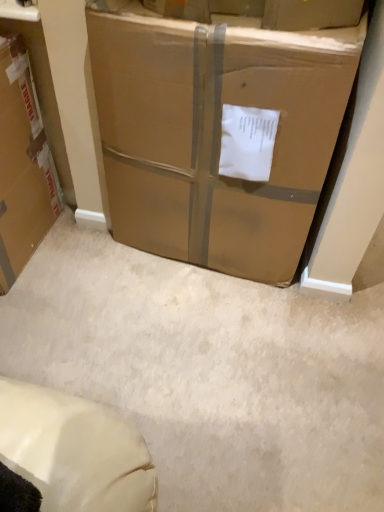
Find the location of a particular element. This screenshot has width=384, height=512. brown cardboard box at center, the 2th box in the left-to-right sequence is located at coordinates pos(215,134).

This screenshot has height=512, width=384. What do you see at coordinates (215, 134) in the screenshot?
I see `brown cardboard box at center, which is the 1th box in right-to-left order` at bounding box center [215, 134].

Identify the location of brown cardboard box at left, placed as the 2th box when sorted from right to left. The height and width of the screenshot is (512, 384). (22, 165).

What do you see at coordinates (22, 165) in the screenshot? I see `brown cardboard box at left, placed as the 2th box when sorted from right to left` at bounding box center [22, 165].

Identify the location of brown cardboard box at center, the 2th box in the left-to-right sequence. The height and width of the screenshot is (512, 384). (215, 134).

Can you confirm if brown cardboard box at left, placed as the first box when sorted from left to right, is positioned to the right of brown cardboard box at center, which is the 1th box in right-to-left order?

Incorrect, brown cardboard box at left, placed as the first box when sorted from left to right, is not on the right side of brown cardboard box at center, which is the 1th box in right-to-left order.

Which object is further away from the camera taking this photo, brown cardboard box at left, placed as the 2th box when sorted from right to left, or brown cardboard box at center, the 2th box in the left-to-right sequence?

brown cardboard box at left, placed as the 2th box when sorted from right to left, is further from the camera.

Considering the positions of point (2, 146) and point (187, 106), is point (2, 146) closer or farther from the camera than point (187, 106)?

Clearly, point (2, 146) is more distant from the camera than point (187, 106).

From the image's perspective, relative to brown cardboard box at center, the 2th box in the left-to-right sequence, is brown cardboard box at left, placed as the 2th box when sorted from right to left, above or below?

From the image's perspective, brown cardboard box at left, placed as the 2th box when sorted from right to left, appears below brown cardboard box at center, the 2th box in the left-to-right sequence.

From a real-world perspective, who is located lower, brown cardboard box at left, placed as the 2th box when sorted from right to left, or brown cardboard box at center, which is the 1th box in right-to-left order?

In real-world perspective, brown cardboard box at left, placed as the 2th box when sorted from right to left, is lower.

Does brown cardboard box at left, placed as the first box when sorted from left to right, have a lesser width compared to brown cardboard box at center, the 2th box in the left-to-right sequence?

In fact, brown cardboard box at left, placed as the first box when sorted from left to right, might be wider than brown cardboard box at center, the 2th box in the left-to-right sequence.

From their relative heights in the image, would you say brown cardboard box at left, placed as the 2th box when sorted from right to left, is taller or shorter than brown cardboard box at center, the 2th box in the left-to-right sequence?

In the image, brown cardboard box at left, placed as the 2th box when sorted from right to left, appears to be shorter than brown cardboard box at center, the 2th box in the left-to-right sequence.

Which of these two, brown cardboard box at left, placed as the first box when sorted from left to right, or brown cardboard box at center, the 2th box in the left-to-right sequence, is bigger?

brown cardboard box at center, the 2th box in the left-to-right sequence, is bigger.

Is brown cardboard box at left, placed as the first box when sorted from left to right, situated inside brown cardboard box at center, the 2th box in the left-to-right sequence, or outside?

brown cardboard box at left, placed as the first box when sorted from left to right, is outside brown cardboard box at center, the 2th box in the left-to-right sequence.

Is there a large distance between brown cardboard box at left, placed as the 2th box when sorted from right to left, and brown cardboard box at center, which is the 1th box in right-to-left order?

brown cardboard box at left, placed as the 2th box when sorted from right to left, is actually quite close to brown cardboard box at center, which is the 1th box in right-to-left order.

Is brown cardboard box at left, placed as the first box when sorted from left to right, positioned with its back to brown cardboard box at center, the 2th box in the left-to-right sequence?

No, brown cardboard box at center, the 2th box in the left-to-right sequence, is not at the back of brown cardboard box at left, placed as the first box when sorted from left to right.

What's the angular difference between brown cardboard box at left, placed as the first box when sorted from left to right, and brown cardboard box at center, the 2th box in the left-to-right sequence,'s facing directions?

They differ by 5.86 degrees in their facing directions.

Where is `box that is below the brown cardboard box at center, which is the 1th box in right-to-left order (from the image's perspective)`? box that is below the brown cardboard box at center, which is the 1th box in right-to-left order (from the image's perspective) is located at coordinates (22, 165).

In the scene shown: Considering the positions of objects brown cardboard box at center, the 2th box in the left-to-right sequence, and brown cardboard box at left, placed as the first box when sorted from left to right, in the image provided, who is more to the right, brown cardboard box at center, the 2th box in the left-to-right sequence, or brown cardboard box at left, placed as the first box when sorted from left to right,?

brown cardboard box at center, the 2th box in the left-to-right sequence.

Does brown cardboard box at center, which is the 1th box in right-to-left order, come in front of brown cardboard box at left, placed as the 2th box when sorted from right to left?

Yes, brown cardboard box at center, which is the 1th box in right-to-left order, is closer to the viewer.

Which is less distant, (133, 76) or (5, 99)?

Point (133, 76).

From the picture: From the image's perspective, who appears lower, brown cardboard box at center, which is the 1th box in right-to-left order, or brown cardboard box at left, placed as the first box when sorted from left to right?

brown cardboard box at left, placed as the first box when sorted from left to right, from the image's perspective.

From a real-world perspective, is brown cardboard box at center, which is the 1th box in right-to-left order, positioned under brown cardboard box at left, placed as the first box when sorted from left to right, based on gravity?

Incorrect, from a real-world perspective, brown cardboard box at center, which is the 1th box in right-to-left order, is higher than brown cardboard box at left, placed as the first box when sorted from left to right.

Between brown cardboard box at center, the 2th box in the left-to-right sequence, and brown cardboard box at left, placed as the first box when sorted from left to right, which one has smaller width?

brown cardboard box at center, the 2th box in the left-to-right sequence, is thinner.

Between brown cardboard box at center, which is the 1th box in right-to-left order, and brown cardboard box at left, placed as the 2th box when sorted from right to left, which one has more height?

With more height is brown cardboard box at center, which is the 1th box in right-to-left order.

In the scene shown: Considering the relative sizes of brown cardboard box at center, the 2th box in the left-to-right sequence, and brown cardboard box at left, placed as the first box when sorted from left to right, in the image provided, is brown cardboard box at center, the 2th box in the left-to-right sequence, smaller than brown cardboard box at left, placed as the first box when sorted from left to right,?

No.

Is brown cardboard box at center, the 2th box in the left-to-right sequence, located outside brown cardboard box at left, placed as the first box when sorted from left to right?

brown cardboard box at center, the 2th box in the left-to-right sequence, is positioned outside brown cardboard box at left, placed as the first box when sorted from left to right.

Is brown cardboard box at center, the 2th box in the left-to-right sequence, placed right next to brown cardboard box at left, placed as the first box when sorted from left to right?

No.

Is brown cardboard box at center, which is the 1th box in right-to-left order, facing towards brown cardboard box at left, placed as the 2th box when sorted from right to left?

No, brown cardboard box at center, which is the 1th box in right-to-left order, is not turned towards brown cardboard box at left, placed as the 2th box when sorted from right to left.

How many degrees apart are the facing directions of brown cardboard box at center, which is the 1th box in right-to-left order, and brown cardboard box at left, placed as the first box when sorted from left to right?

5.86 degrees separate the facing orientations of brown cardboard box at center, which is the 1th box in right-to-left order, and brown cardboard box at left, placed as the first box when sorted from left to right.

Image resolution: width=384 pixels, height=512 pixels. Find the location of `box on the right of brown cardboard box at left, placed as the 2th box when sorted from right to left`. box on the right of brown cardboard box at left, placed as the 2th box when sorted from right to left is located at coordinates (215, 134).

Find the location of `box behind the brown cardboard box at center, which is the 1th box in right-to-left order`. box behind the brown cardboard box at center, which is the 1th box in right-to-left order is located at coordinates (22, 165).

At what (x,y) coordinates should I click in order to perform the action: click on box that appears above the brown cardboard box at left, placed as the 2th box when sorted from right to left (from the image's perspective). Please return your answer as a coordinate pair (x, y). This screenshot has height=512, width=384. Looking at the image, I should click on (215, 134).